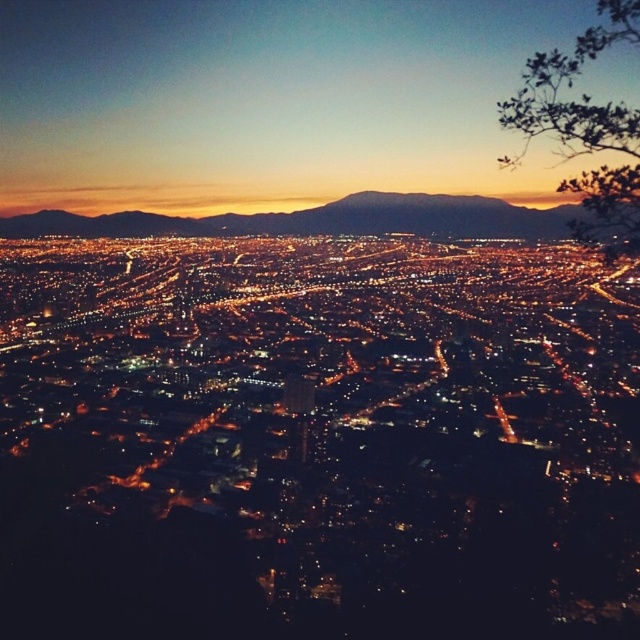
Question: Which point is closer to the camera?

Choices:
 (A) (401, 104)
 (B) (470, 211)

Answer: (A)

Question: Is matte orange sky at upper center bigger than dark brown mountain at center?

Choices:
 (A) no
 (B) yes

Answer: (B)

Question: Which point is closer to the camera?

Choices:
 (A) matte orange sky at upper center
 (B) dark brown mountain at center

Answer: (B)

Question: Which point is farther to the camera?

Choices:
 (A) matte orange sky at upper center
 (B) dark brown mountain at center

Answer: (A)

Question: In this image, where is matte orange sky at upper center located relative to dark brown mountain at center?

Choices:
 (A) left
 (B) right

Answer: (B)

Question: Does matte orange sky at upper center appear on the right side of dark brown mountain at center?

Choices:
 (A) no
 (B) yes

Answer: (B)